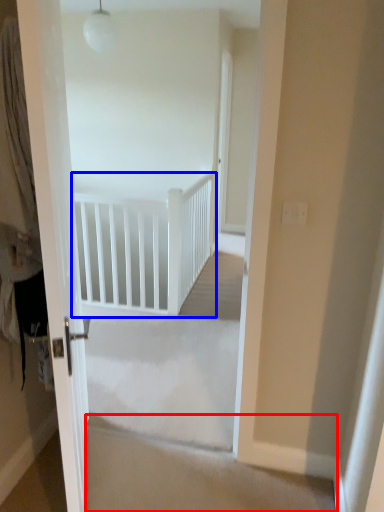
Question: Which object is closer to the camera taking this photo, stairwell (highlighted by a red box) or rail (highlighted by a blue box)?

Choices:
 (A) stairwell
 (B) rail

Answer: (A)